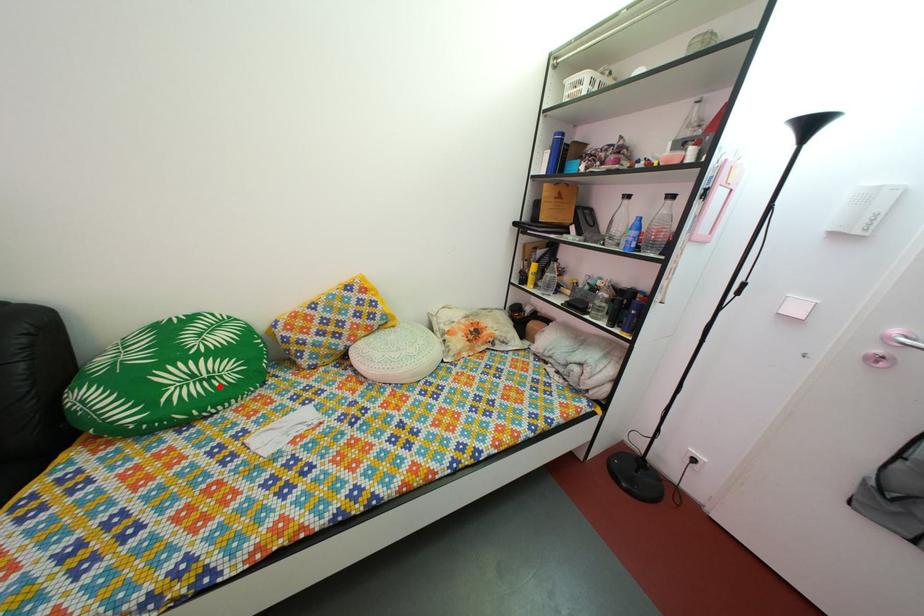
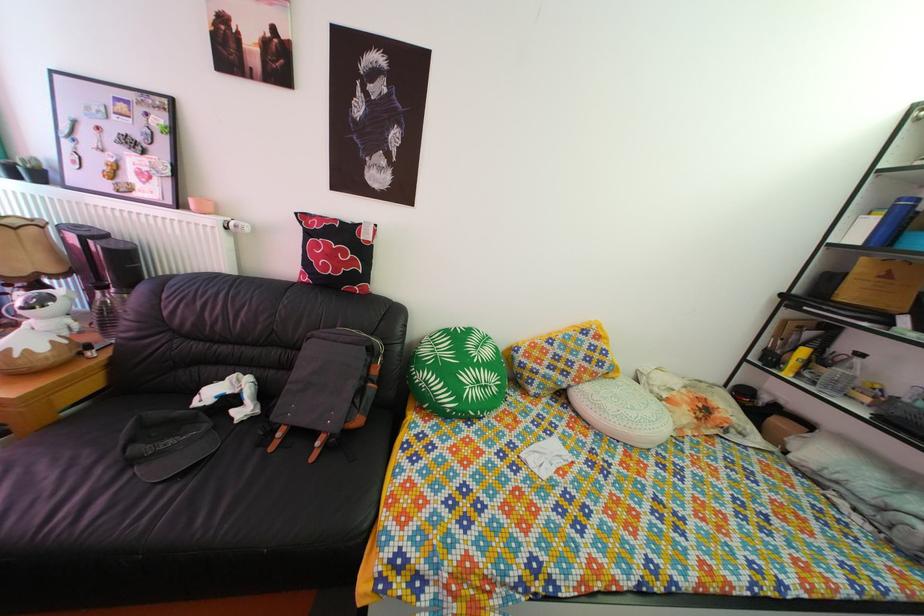
Question: A red point is marked in image1. In image2, is the corresponding 3D point closer to the camera or farther? Reply with the corresponding letter.

Choices:
 (A) The corresponding 3D point is closer.
 (B) The corresponding 3D point is farther.

Answer: (B)